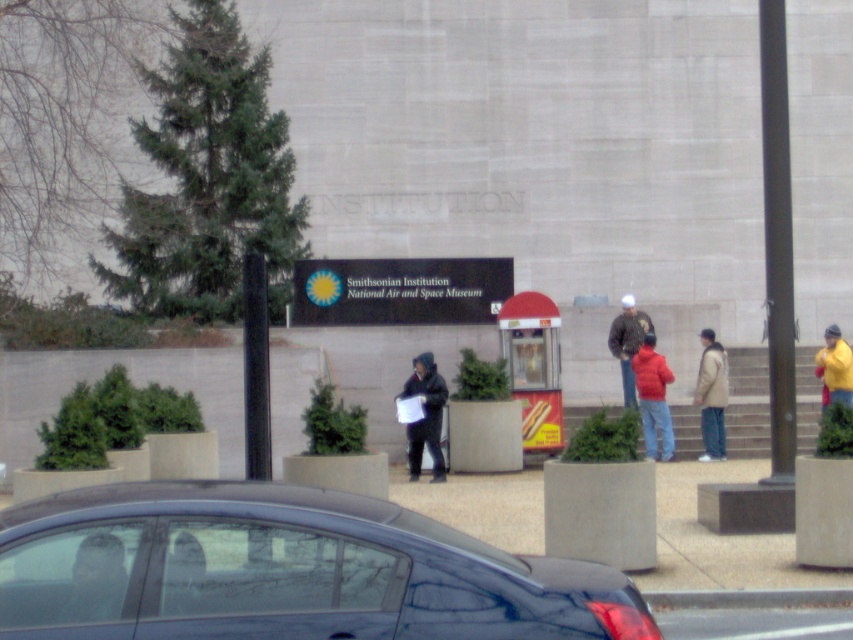
Between matte red jacket at center and matte black jacket at center, which one is positioned lower?

matte red jacket at center is lower down.

The width and height of the screenshot is (853, 640). What are the coordinates of `matte red jacket at center` in the screenshot? It's located at (653, 397).

Describe the element at coordinates (653, 397) in the screenshot. The image size is (853, 640). I see `matte red jacket at center` at that location.

Locate an element on the screen. The height and width of the screenshot is (640, 853). matte red jacket at center is located at coordinates (653, 397).

Does matte black jacket at center have a greater width compared to light brown jacket at center?

Incorrect, matte black jacket at center's width does not surpass light brown jacket at center's.

Which is above, matte black jacket at center or light brown jacket at center?

Positioned higher is matte black jacket at center.

Is point (204, 611) farther from viewer compared to point (704, 328)?

That is False.

The width and height of the screenshot is (853, 640). I want to click on matte black jacket at center, so click(x=183, y=573).

Consider the image. Is matte black jacket at center taller than red jacket at center?

No, matte black jacket at center is not taller than red jacket at center.

Who is shorter, matte black jacket at center or red jacket at center?

matte black jacket at center is shorter.

Who is more distant from viewer, [165,577] or [612,349]?

The point [612,349] is behind.

Locate an element on the screen. matte black jacket at center is located at coordinates (183, 573).